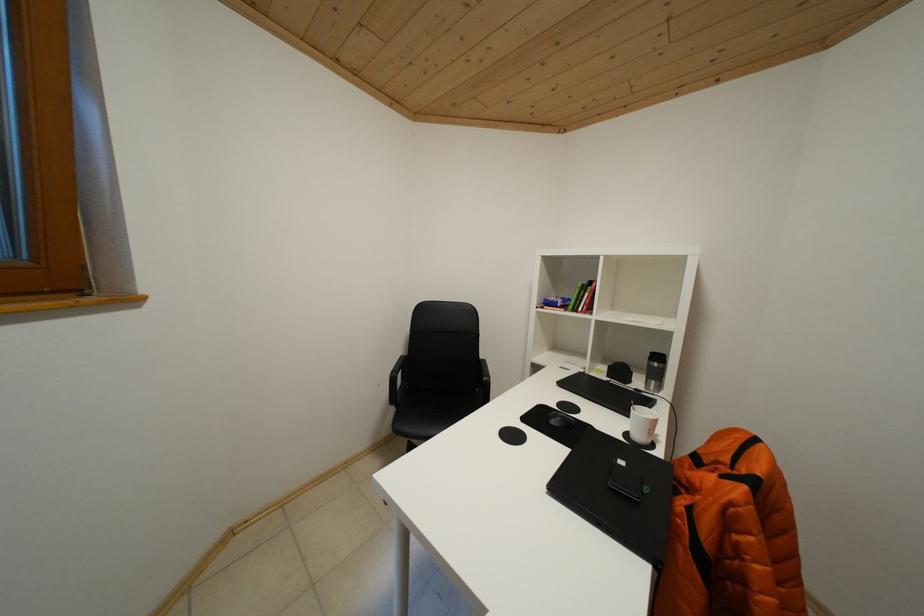
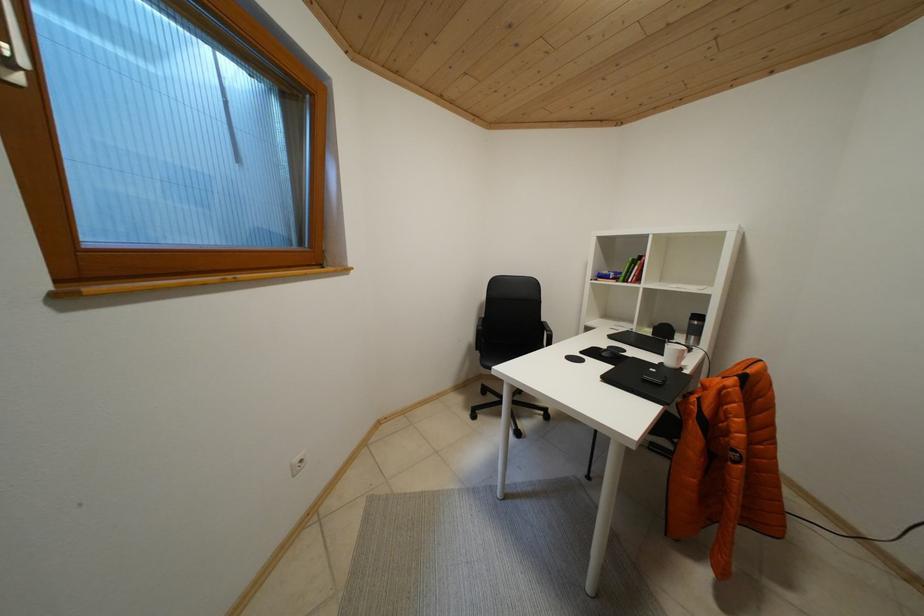
The images are taken continuously from a first-person perspective. In which direction are you moving?

The movement direction of the cameraman is left, backward.